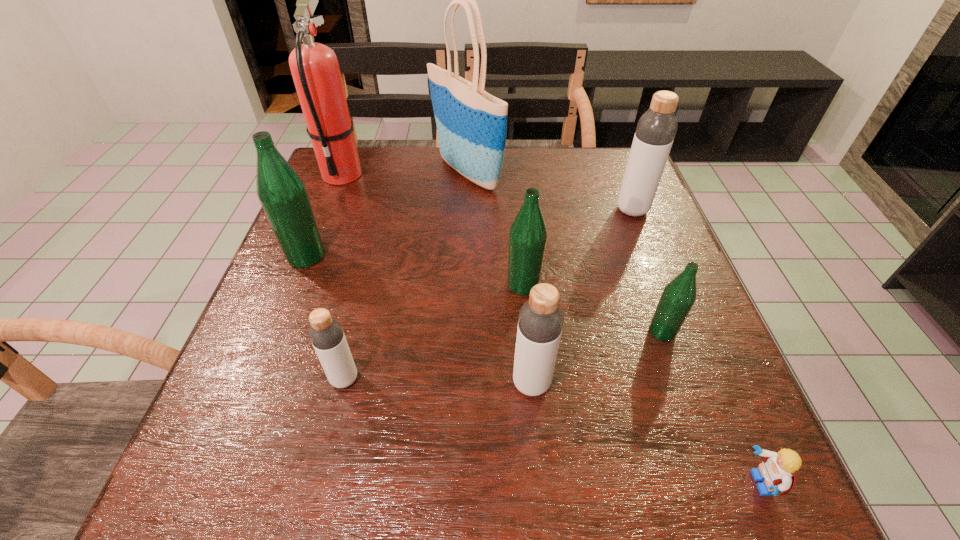
You are a GUI agent. You are given a task and a screenshot of the screen. Output one action in this format:
    pyautogui.click(x=<x>, y=<y>)
    Task: Click on the unoccupied area between the fire extinguisher and the rightmost green bottle
    This screenshot has width=960, height=540.
    Given the screenshot: What is the action you would take?
    pyautogui.click(x=502, y=253)

I want to click on free spot between the farthest green bottle and the smallest green bottle, so click(484, 294).

Locate an element on the screen. This screenshot has width=960, height=540. vacant area between the blue tote bag and the smallest green bottle is located at coordinates (564, 252).

Where is `free space that is in between the leftmost gray bottle and the second biggest gray bottle`? The height and width of the screenshot is (540, 960). free space that is in between the leftmost gray bottle and the second biggest gray bottle is located at coordinates (438, 381).

The image size is (960, 540). What are the coordinates of `free spot between the rightmost green bottle and the second smallest green bottle` in the screenshot? It's located at (592, 308).

This screenshot has width=960, height=540. In order to click on vacant area that lies between the third farthest object and the fourth farthest bottle in this screenshot , I will do `click(647, 271)`.

You are a GUI agent. You are given a task and a screenshot of the screen. Output one action in this format:
    pyautogui.click(x=<x>, y=<y>)
    Task: Click on the free space between the second farthest green bottle and the second farthest bottle
    The image size is (960, 540).
    Given the screenshot: What is the action you would take?
    pyautogui.click(x=415, y=271)

You are a GUI agent. You are given a task and a screenshot of the screen. Output one action in this format:
    pyautogui.click(x=<x>, y=<y>)
    Task: Click on the vacant point located between the tote bag and the fire extinguisher
    
    Given the screenshot: What is the action you would take?
    pyautogui.click(x=404, y=173)

Locate an element on the screen. The width and height of the screenshot is (960, 540). empty space between the second gray bottle from right to left and the smallest green bottle is located at coordinates (597, 357).

This screenshot has height=540, width=960. Identify the location of object that is the eighth closest to the second bottle from left to right. (656, 129).